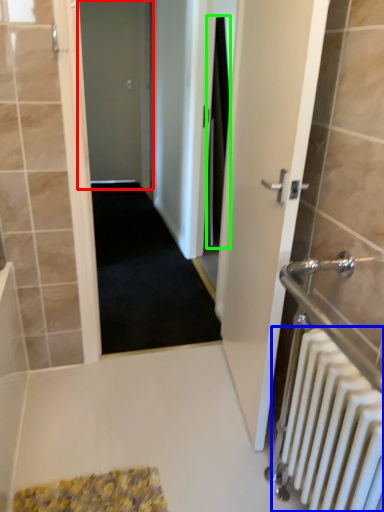
Question: Which object is positioned farthest from door (highlighted by a red box)? Select from radiator (highlighted by a blue box) and shower curtain (highlighted by a green box).

Choices:
 (A) radiator
 (B) shower curtain

Answer: (A)